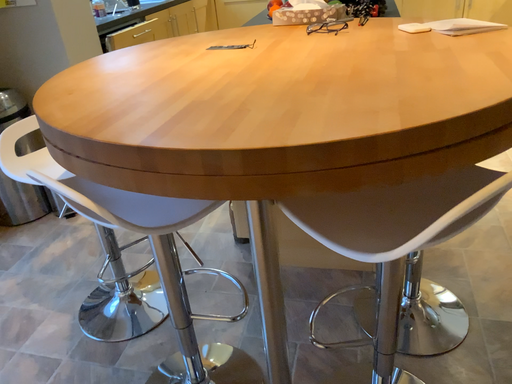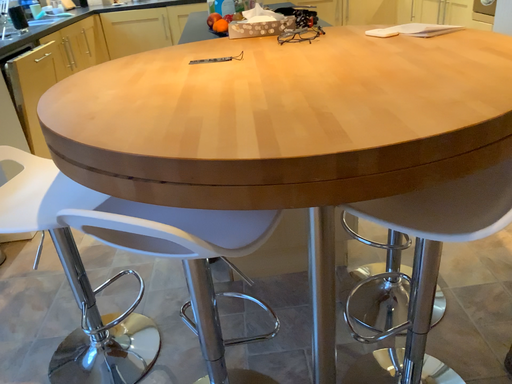
Question: How did the camera likely rotate when shooting the video?

Choices:
 (A) rotated left
 (B) rotated right

Answer: (B)